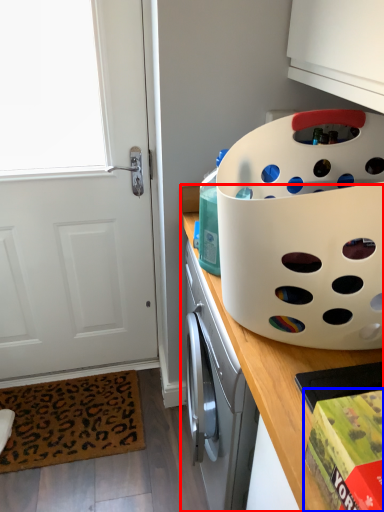
Question: Which object is closer to the camera taking this photo, countertop (highlighted by a red box) or box (highlighted by a blue box)?

Choices:
 (A) countertop
 (B) box

Answer: (B)